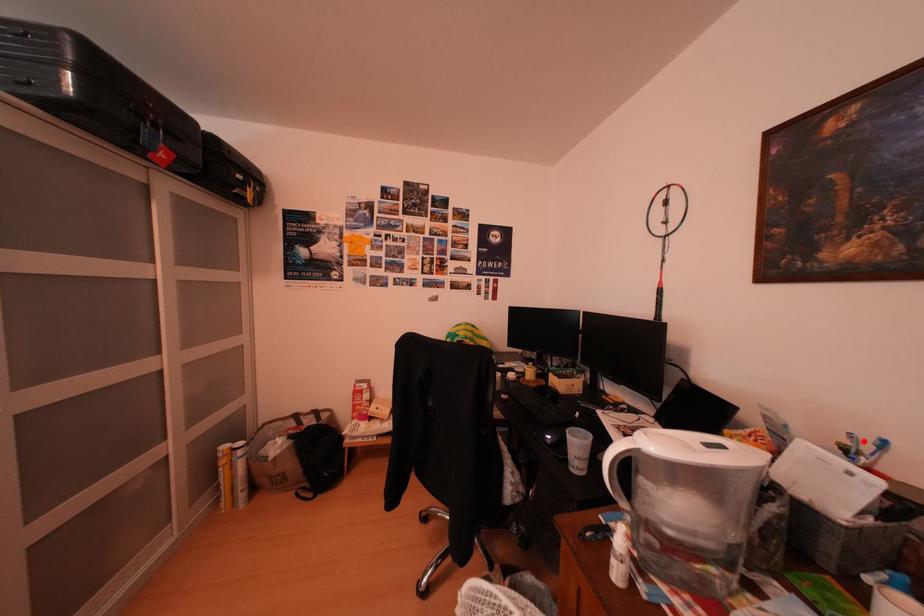
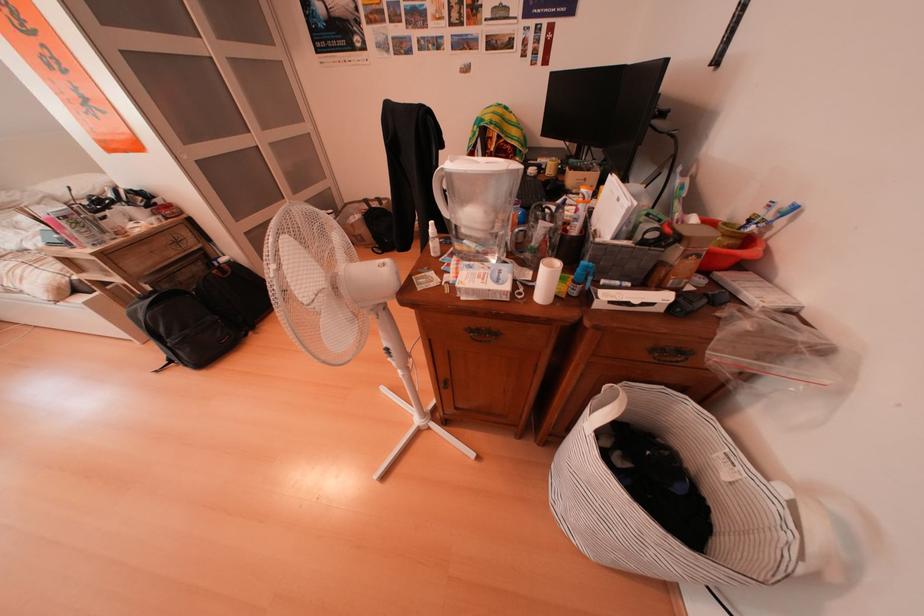
Where in the second image is the point corresponding to the highlighted location from the first image?

(784, 209)